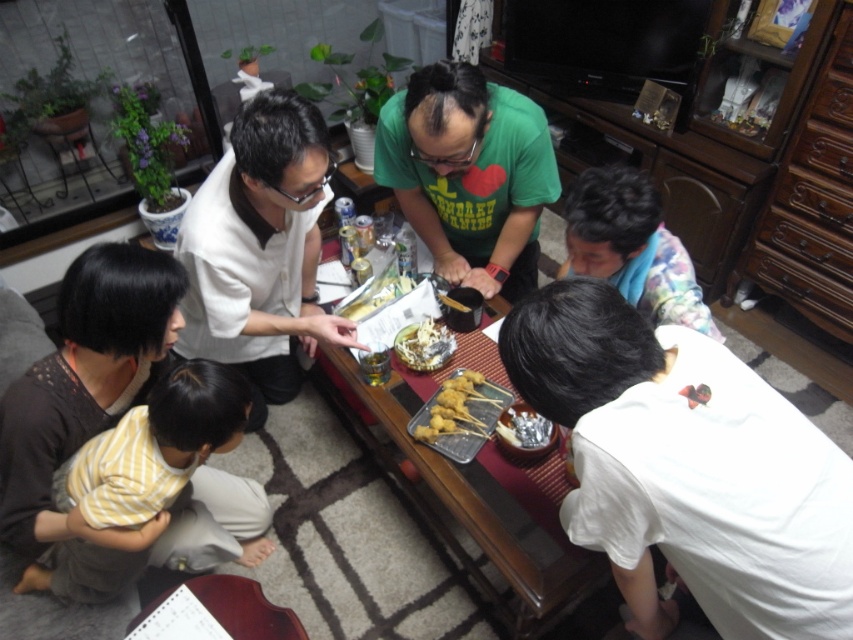
You are a guest at this gathering and want to grab a drink from the table. The wooden tray at center has some skewers on it, and the yellow striped shirt at lower left is nearby. Can you easily reach the drinks without moving the tray or the shirt?

The wooden tray at center is bigger than the yellow striped shirt at lower left, so there might still be space around them to reach the drinks without moving either object.

Looking at this image, where is the white matte shirt at upper left located in the image?

The white matte shirt at upper left is located at point (260, 250).